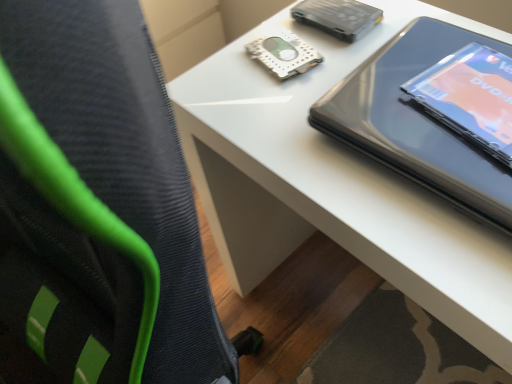
What do you see at coordinates (333, 183) in the screenshot? I see `white glossy table at upper right` at bounding box center [333, 183].

This screenshot has width=512, height=384. What are the coordinates of `white glossy table at upper right` in the screenshot? It's located at pos(333,183).

Measure the distance between point (x=393, y=227) and camera.

Point (x=393, y=227) and camera are 16.61 inches apart from each other.

In order to face white glossy table at upper right, should I rotate leftwards or rightwards?

Rotate right and turn 21.727 degrees.

Consider the image. What is the approximate width of matte black tablet at upper right?

It is 10.93 inches.

I want to click on matte black tablet at upper right, so click(x=417, y=121).

The width and height of the screenshot is (512, 384). What do you see at coordinates (417, 121) in the screenshot? I see `matte black tablet at upper right` at bounding box center [417, 121].

Locate an element on the screen. white glossy table at upper right is located at coordinates (333, 183).

Based on their positions, is white glossy table at upper right located to the left or right of matte black tablet at upper right?

white glossy table at upper right is to the left of matte black tablet at upper right.

Relative to matte black tablet at upper right, is white glossy table at upper right in front or behind?

In the image, white glossy table at upper right appears in front of matte black tablet at upper right.

Considering the points (419, 223) and (385, 93), which point is behind, point (419, 223) or point (385, 93)?

The point (385, 93) is more distant.

From the picture: From the image's perspective, between white glossy table at upper right and matte black tablet at upper right, which one is located above?

matte black tablet at upper right.

From a real-world perspective, is white glossy table at upper right on top of matte black tablet at upper right?

No, from a real-world perspective, white glossy table at upper right is not on top of matte black tablet at upper right.

Is white glossy table at upper right wider or thinner than matte black tablet at upper right?

Clearly, white glossy table at upper right has more width compared to matte black tablet at upper right.

Can you confirm if white glossy table at upper right is shorter than matte black tablet at upper right?

In fact, white glossy table at upper right may be taller than matte black tablet at upper right.

Considering the sizes of white glossy table at upper right and matte black tablet at upper right in the image, is white glossy table at upper right bigger or smaller than matte black tablet at upper right?

white glossy table at upper right is bigger than matte black tablet at upper right.

Would you say white glossy table at upper right is outside matte black tablet at upper right?

Absolutely, white glossy table at upper right is external to matte black tablet at upper right.

In the scene shown: Is white glossy table at upper right in contact with matte black tablet at upper right?

white glossy table at upper right is not next to matte black tablet at upper right, and they're not touching.

Could you tell me if white glossy table at upper right is turned towards matte black tablet at upper right?

No, white glossy table at upper right does not turn towards matte black tablet at upper right.

How much distance is there between white glossy table at upper right and matte black tablet at upper right?

The distance of white glossy table at upper right from matte black tablet at upper right is 8.32 inches.

Locate an element on the screen. The image size is (512, 384). table that appears on the left of matte black tablet at upper right is located at coordinates (333, 183).

Is matte black tablet at upper right at the right side of white glossy table at upper right?

Yes, matte black tablet at upper right is to the right of white glossy table at upper right.

Which object is further away from the camera, matte black tablet at upper right or white glossy table at upper right?

matte black tablet at upper right is further from the camera.

Is point (350, 125) positioned after point (394, 26)?

No.

Looking at this image, from the image's perspective, which is above, matte black tablet at upper right or white glossy table at upper right?

matte black tablet at upper right, from the image's perspective.

From a real-world perspective, is matte black tablet at upper right physically below white glossy table at upper right?

No.

From the picture: Considering the sizes of objects matte black tablet at upper right and white glossy table at upper right in the image provided, who is thinner, matte black tablet at upper right or white glossy table at upper right?

matte black tablet at upper right.

Is matte black tablet at upper right shorter than white glossy table at upper right?

Yes.

Who is smaller, matte black tablet at upper right or white glossy table at upper right?

matte black tablet at upper right.

Is matte black tablet at upper right not inside white glossy table at upper right?

Actually, matte black tablet at upper right is at least partially inside white glossy table at upper right.

Would you consider matte black tablet at upper right to be distant from white glossy table at upper right?

They are positioned close to each other.

Could you tell me if matte black tablet at upper right is facing white glossy table at upper right?

Yes, matte black tablet at upper right is oriented towards white glossy table at upper right.

How much distance is there between matte black tablet at upper right and white glossy table at upper right?

matte black tablet at upper right is 8.32 inches away from white glossy table at upper right.

Image resolution: width=512 pixels, height=384 pixels. What are the coordinates of `table on the left side of matte black tablet at upper right` in the screenshot? It's located at (333, 183).

Image resolution: width=512 pixels, height=384 pixels. I want to click on table in front of the matte black tablet at upper right, so click(333, 183).

Where is `tablet computer on the right of white glossy table at upper right`? The width and height of the screenshot is (512, 384). tablet computer on the right of white glossy table at upper right is located at coordinates (417, 121).